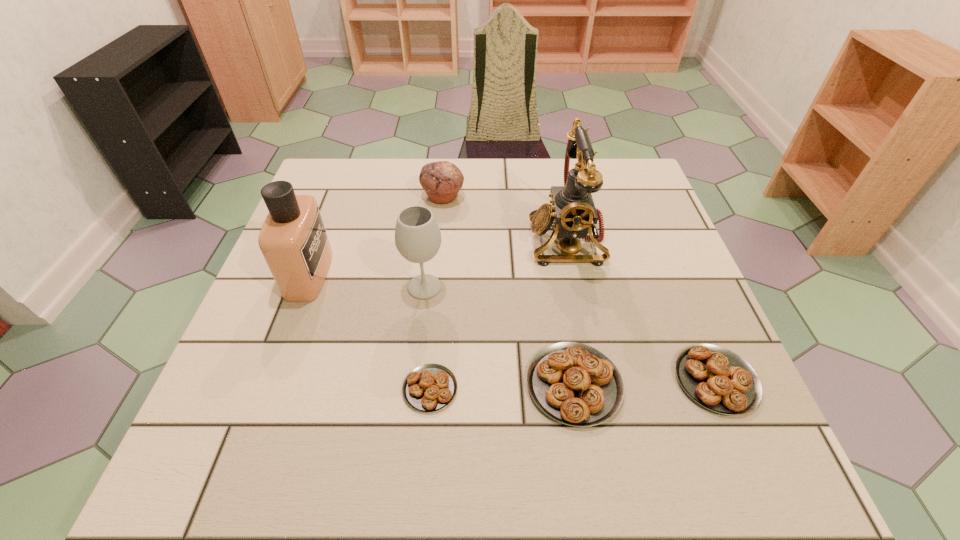
The width and height of the screenshot is (960, 540). Find the location of `object that ranks as the second closest to the second pastry from left to right`. object that ranks as the second closest to the second pastry from left to right is located at coordinates click(428, 388).

You are a GUI agent. You are given a task and a screenshot of the screen. Output one action in this format:
    pyautogui.click(x=<x>, y=<y>)
    Task: Click on the second closest pastry to the second pastry from right to left
    This screenshot has height=540, width=960.
    Given the screenshot: What is the action you would take?
    pyautogui.click(x=428, y=388)

Locate an element on the screen. pastry identified as the third closest to the perfume is located at coordinates (718, 379).

I want to click on vacant space that satisfies the following two spatial constraints: 1. on the front side of the shortest pastry; 2. on the left side of the fourth tallest object, so click(424, 389).

I want to click on free spot that satisfies the following two spatial constraints: 1. on the front of the second tallest pastry, featuring the rotary dial; 2. on the left side of the tallest object, so click(x=596, y=380).

Identify the location of vacant point that satisfies the following two spatial constraints: 1. on the front label of the perfume; 2. on the left side of the rightmost pastry. (270, 380).

The width and height of the screenshot is (960, 540). Find the location of `free spot that satisfies the following two spatial constraints: 1. on the front of the telephone, featuring the rotary dial; 2. on the left side of the rightmost object`. free spot that satisfies the following two spatial constraints: 1. on the front of the telephone, featuring the rotary dial; 2. on the left side of the rightmost object is located at coordinates (596, 380).

Find the location of a particular element. free spot that satisfies the following two spatial constraints: 1. on the front label of the leftmost object; 2. on the left side of the leftmost pastry is located at coordinates (266, 389).

The height and width of the screenshot is (540, 960). What are the coordinates of `vacant space that satisfies the following two spatial constraints: 1. on the front label of the leftmost pastry; 2. on the left side of the leftmost object` in the screenshot? It's located at (266, 389).

Identify the location of vacant space that satisfies the following two spatial constraints: 1. on the front side of the second pastry from left to right; 2. on the left side of the wineglass. (413, 384).